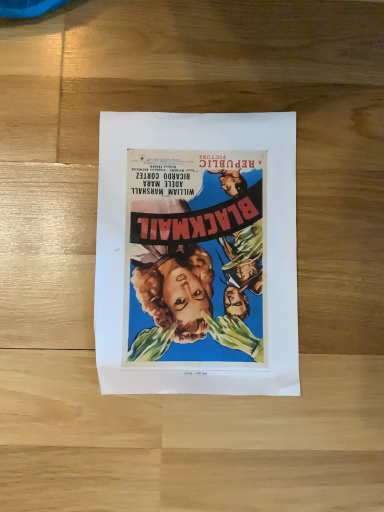
In order to face vibrant paper poster at center, should I rotate leftwards or rightwards?

You should look right and rotate roughly 0.560 degrees.

Find the location of `vibrant paper poster at center`. vibrant paper poster at center is located at coordinates (197, 254).

Describe the element at coordinates (197, 254) in the screenshot. I see `vibrant paper poster at center` at that location.

Locate an element on the screen. Image resolution: width=384 pixels, height=512 pixels. vibrant paper poster at center is located at coordinates [197, 254].